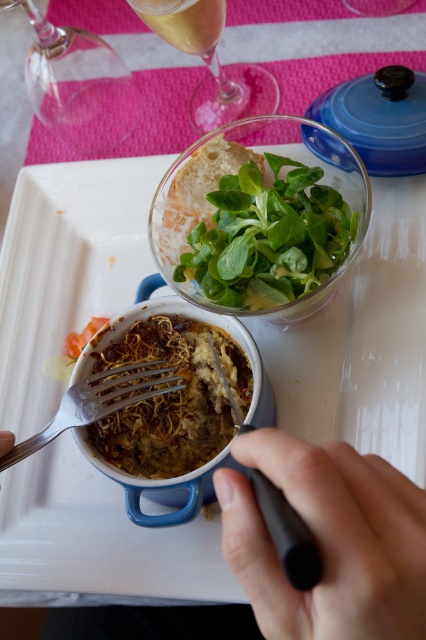
You are trying to pick up the black rubber pen at lower center but there is a black plastic fork at lower center in the way. Which direction should you move the fork to get the pen?

Since the black rubber pen at lower center is to the right of the black plastic fork at lower center, you should move the fork to the left to access the pen.

What is the point at coordinate [328,540] located on?

The point at coordinate [328,540] is located on the black rubber pen at lower center.

You are trying to reach for the black plastic fork at lower center but there is a black rubber pen at lower center in the way. Can you move the pen to get the fork?

The black rubber pen at lower center is 1.10 inches away from the black plastic fork at lower center. Since the distance is small, you can easily move the pen to access the fork.